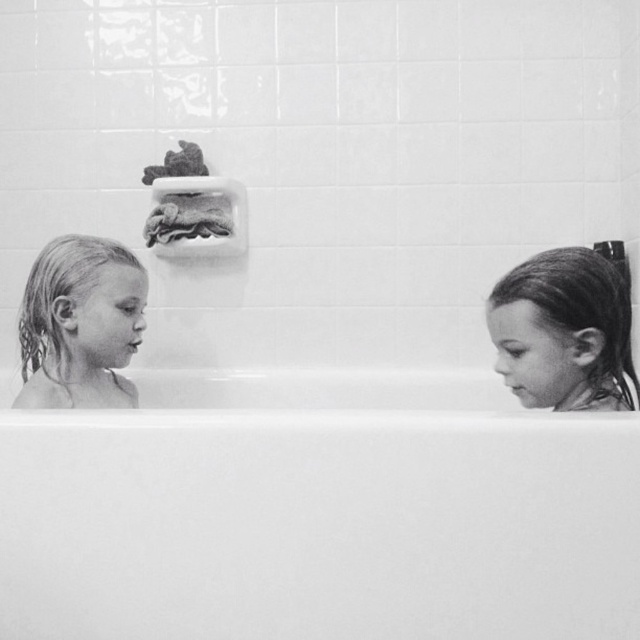
Between white smooth bathtub at center and wet blonde hair at left, which one has less height?

Standing shorter between the two is wet blonde hair at left.

What are the coordinates of `white smooth bathtub at center` in the screenshot? It's located at (320, 513).

Who is positioned more to the left, white smooth bathtub at center or wet hair at right?

Positioned to the left is white smooth bathtub at center.

The height and width of the screenshot is (640, 640). I want to click on white smooth bathtub at center, so click(320, 513).

From the picture: Can you confirm if wet hair at right is bigger than wet blonde hair at left?

No.

Who is lower down, wet hair at right or wet blonde hair at left?

Positioned lower is wet blonde hair at left.

Is point (515, 358) positioned behind point (65, 250)?

No.

Image resolution: width=640 pixels, height=640 pixels. Find the location of `wet hair at right`. wet hair at right is located at coordinates (563, 332).